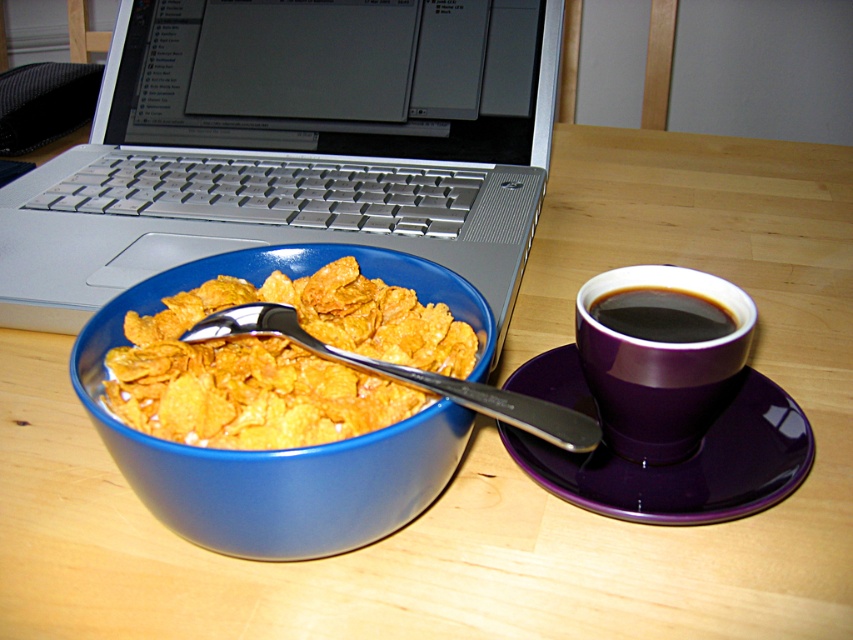
Question: Can you confirm if purple glossy saucer at right is smaller than silver metallic spoon at bowl center?

Choices:
 (A) no
 (B) yes

Answer: (A)

Question: Where is silver metallic laptop at upper left located in relation to blue glossy bowl at center in the image?

Choices:
 (A) right
 (B) left

Answer: (B)

Question: Which point is farther from the camera taking this photo?

Choices:
 (A) (141, 193)
 (B) (337, 355)
 (C) (793, 484)

Answer: (A)

Question: Which is farther from the blue glossy bowl at center?

Choices:
 (A) silver metallic spoon at bowl center
 (B) black glossy cup at right
 (C) purple glossy saucer at right
 (D) silver metallic laptop at upper left

Answer: (D)

Question: Among these objects, which one is farthest from the camera?

Choices:
 (A) silver metallic spoon at bowl center
 (B) black glossy cup at right

Answer: (B)

Question: Is purple glossy saucer at right below purple glossy mug at upper right?

Choices:
 (A) yes
 (B) no

Answer: (A)